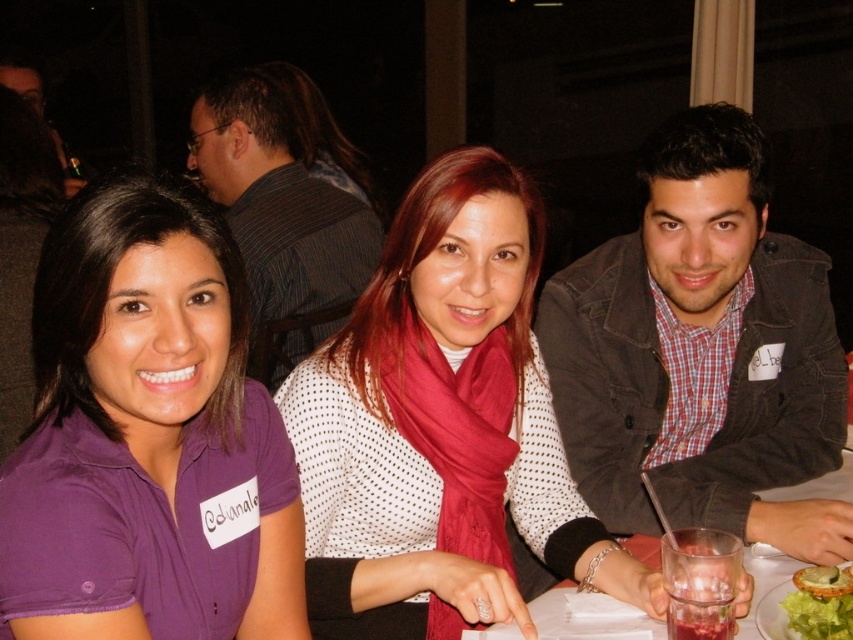
You are a photographer at a social event and need to capture a photo of the purple cotton shirt at left and the green leafy lettuce at lower right. Based on their sizes, which object should you focus on first to ensure both are in frame?

The purple cotton shirt at left is taller than the green leafy lettuce at lower right, so you should focus on the purple cotton shirt at left first to accommodate its larger size in the frame.

Based on the photo, you are a photographer taking a picture of the purple cotton shirt at left and the green leafy lettuce at lower right. Which object will appear larger in the photo?

The purple cotton shirt at left will appear larger in the photo because it is closer to the viewer than the green leafy lettuce at lower right.